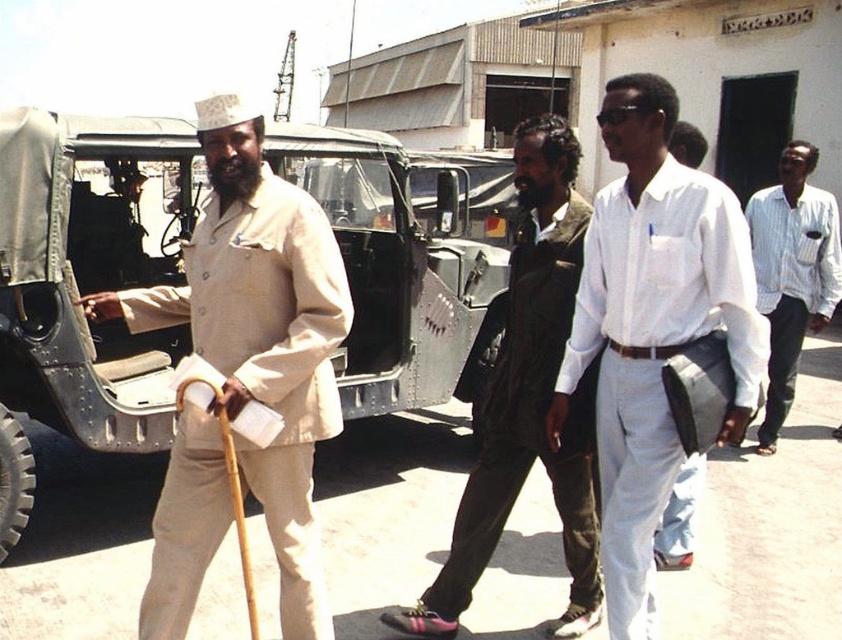
Question: Is metallic green jeep at left smaller than white smooth shirt at center?

Choices:
 (A) no
 (B) yes

Answer: (A)

Question: Is beige fabric coat at left to the left of white striped shirt at right from the viewer's perspective?

Choices:
 (A) no
 (B) yes

Answer: (B)

Question: Is beige fabric coat at left above dark brown leather jacket at center?

Choices:
 (A) no
 (B) yes

Answer: (B)

Question: Among these objects, which one is nearest to the camera?

Choices:
 (A) dark brown leather jacket at center
 (B) metallic green jeep at left
 (C) white striped shirt at right

Answer: (A)

Question: Which point appears closest to the camera in this image?

Choices:
 (A) (301, 477)
 (B) (432, 349)

Answer: (A)

Question: Which of the following is the closest to the observer?

Choices:
 (A) (139, 129)
 (B) (504, 420)

Answer: (B)